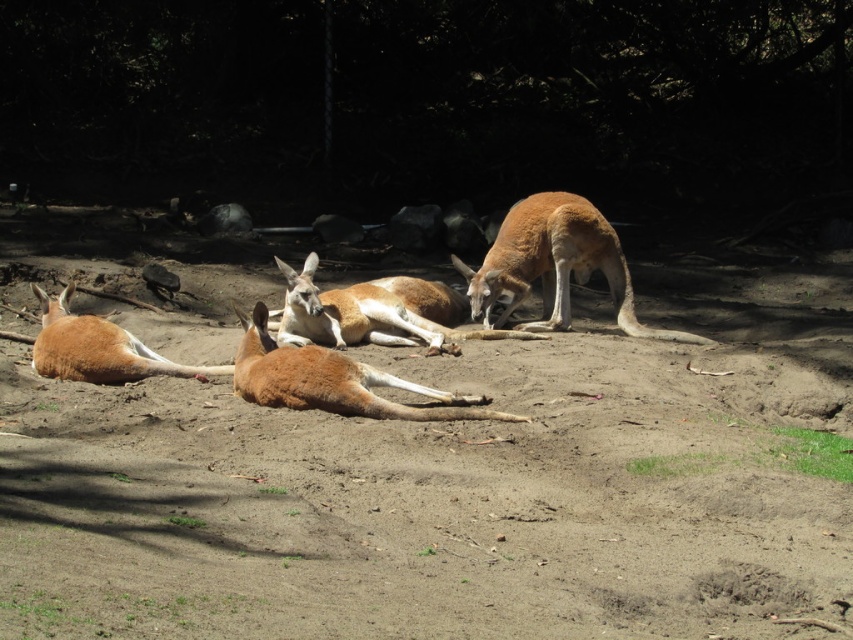
Is smooth brown kangaroo at center positioned at the back of brown fur kangaroo at center?

That is True.

This screenshot has width=853, height=640. What do you see at coordinates (554, 264) in the screenshot?
I see `smooth brown kangaroo at center` at bounding box center [554, 264].

Where is `smooth brown kangaroo at center`? The width and height of the screenshot is (853, 640). smooth brown kangaroo at center is located at coordinates (554, 264).

Is smooth brown kangaroo at center in front of brown furry kangaroo at center?

No.

Measure the distance between smooth brown kangaroo at center and camera.

smooth brown kangaroo at center is 7.73 meters away from camera.

Locate an element on the screen. smooth brown kangaroo at center is located at coordinates (554, 264).

Based on the photo, does brown sandy ground at center have a greater height compared to matte brown kangaroo at lower left?

No, brown sandy ground at center is not taller than matte brown kangaroo at lower left.

Who is positioned more to the right, brown sandy ground at center or matte brown kangaroo at lower left?

Positioned to the right is brown sandy ground at center.

Who is more forward, (440, 442) or (48, 339)?

Positioned in front is point (440, 442).

Identify the location of brown sandy ground at center. The height and width of the screenshot is (640, 853). (438, 499).